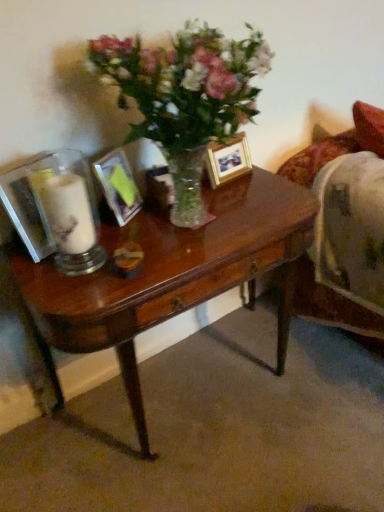
The width and height of the screenshot is (384, 512). I want to click on blank space situated above shiny brown desk at center (from a real-world perspective), so click(189, 222).